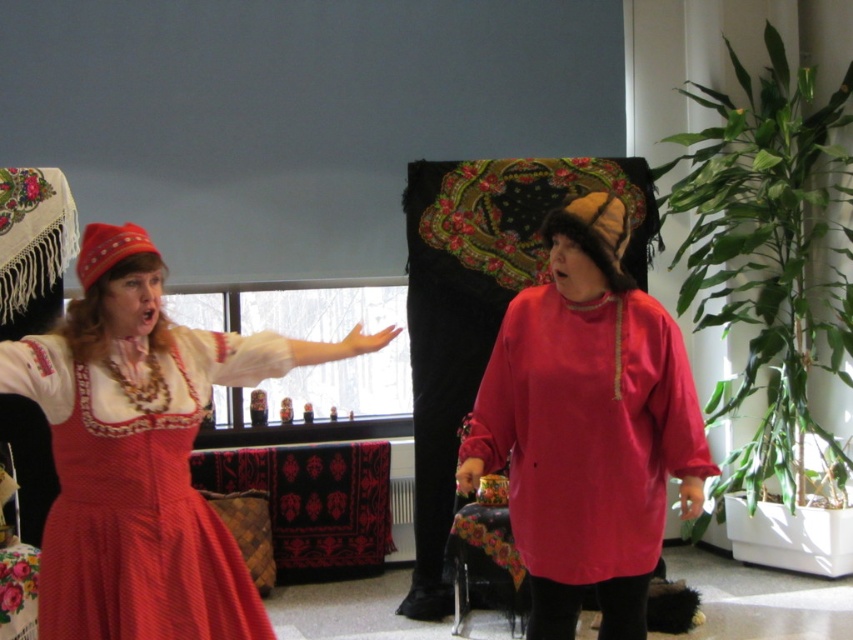
In the scene shown: You are organizing a fashion show and need to arrange two outfits on a mannequin. The first outfit is the matte red blouse at center, and the second is the matte red dress at left. Which outfit requires a wider mannequin base to fit properly?

The matte red blouse at center requires a wider mannequin base because its width is larger than that of the matte red dress at left.

You are an event planner setting up a stage for a cultural performance. The stage has a spotlight that can only illuminate objects above a certain height. You need to ensure both the matte red blouse at center and the matte red dress at left are visible under the spotlight. Based on their positions, which one is positioned higher and therefore more likely to be fully illuminated?

The matte red blouse at center is located above the matte red dress at left, so it is positioned higher and more likely to be fully illuminated by the spotlight.